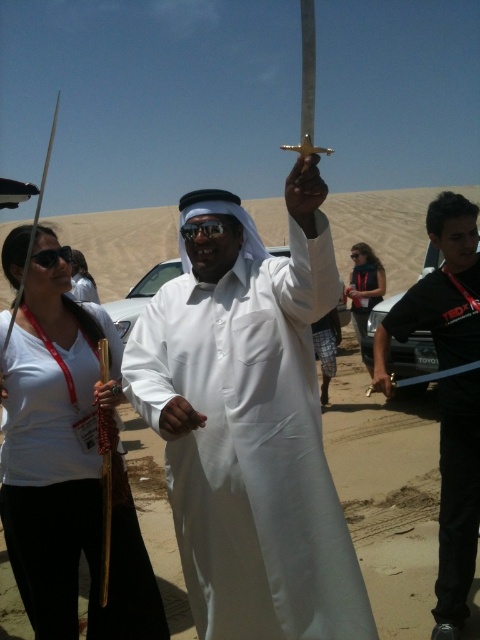
Is point (464, 506) closer to camera compared to point (380, 284)?

Yes, point (464, 506) is in front of point (380, 284).

Identify the location of matte black sword at center. (440, 292).

Where is `matte black sword at center`? The height and width of the screenshot is (640, 480). matte black sword at center is located at coordinates (440, 292).

Is white matte sword at center below matte black sword at center?

No, white matte sword at center is not below matte black sword at center.

Can you confirm if white matte sword at center is bigger than matte black sword at center?

Indeed, white matte sword at center has a larger size compared to matte black sword at center.

Find the location of a particular element. This screenshot has width=480, height=640. white matte sword at center is located at coordinates (250, 424).

The width and height of the screenshot is (480, 640). I want to click on white matte sword at center, so click(x=250, y=424).

Is matte black sword at center taller than matte white shirt at center?

Correct, matte black sword at center is much taller as matte white shirt at center.

Is the position of matte black sword at center more distant than that of matte white shirt at center?

No, it is in front of matte white shirt at center.

Describe the element at coordinates (440, 292) in the screenshot. This screenshot has width=480, height=640. I see `matte black sword at center` at that location.

Image resolution: width=480 pixels, height=640 pixels. Find the location of `matte black sword at center`. matte black sword at center is located at coordinates (440, 292).